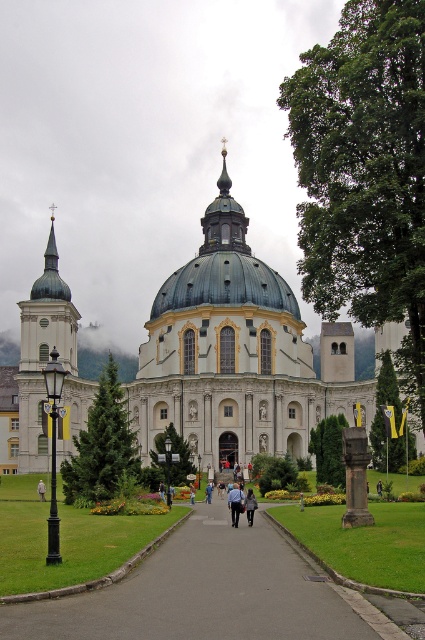
Question: Which is farther from the blue denim jacket at center?

Choices:
 (A) light blue shirt at center
 (B) smooth asphalt path at center

Answer: (B)

Question: Which object appears farthest from the camera in this image?

Choices:
 (A) blue denim jacket at center
 (B) white marble church at center

Answer: (B)

Question: Is white marble church at center smaller than light blue shirt at center?

Choices:
 (A) no
 (B) yes

Answer: (A)

Question: Does white marble church at center appear over light blue shirt at center?

Choices:
 (A) no
 (B) yes

Answer: (B)

Question: Which point is closer to the camera?

Choices:
 (A) (172, 552)
 (B) (221, 388)

Answer: (A)

Question: From the image, what is the correct spatial relationship of white marble church at center in relation to smooth asphalt path at center?

Choices:
 (A) right
 (B) left

Answer: (B)